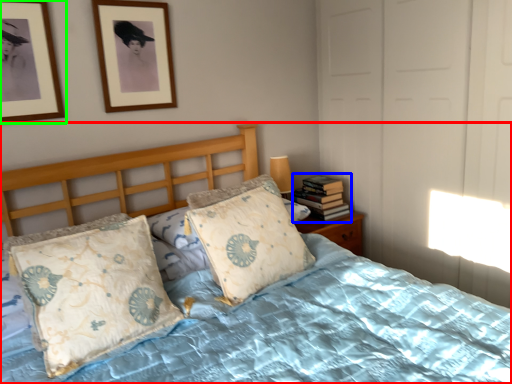
Question: Which is nearer to the bed (highlighted by a red box)? book (highlighted by a blue box) or picture frame (highlighted by a green box).

Choices:
 (A) book
 (B) picture frame

Answer: (A)